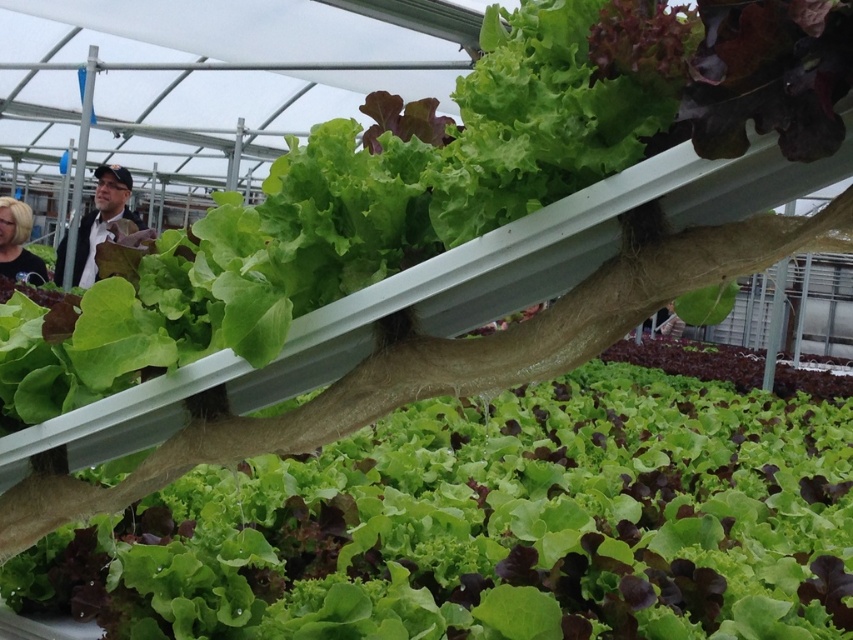
Question: Among these objects, which one is nearest to the camera?

Choices:
 (A) blonde hair at left
 (B) matte black jacket at upper left
 (C) matte black shirt at center

Answer: (C)

Question: Which of the following is the closest to the observer?

Choices:
 (A) (27, 268)
 (B) (668, 305)

Answer: (B)

Question: Can you confirm if matte black jacket at upper left is positioned below matte black shirt at center?

Choices:
 (A) yes
 (B) no

Answer: (B)

Question: Estimate the real-world distances between objects in this image. Which object is farther from the matte black shirt at center?

Choices:
 (A) blonde hair at left
 (B) matte black jacket at upper left

Answer: (A)

Question: Does matte black jacket at upper left appear on the right side of matte black shirt at center?

Choices:
 (A) no
 (B) yes

Answer: (A)

Question: Can you confirm if blonde hair at left is positioned below matte black shirt at center?

Choices:
 (A) yes
 (B) no

Answer: (B)